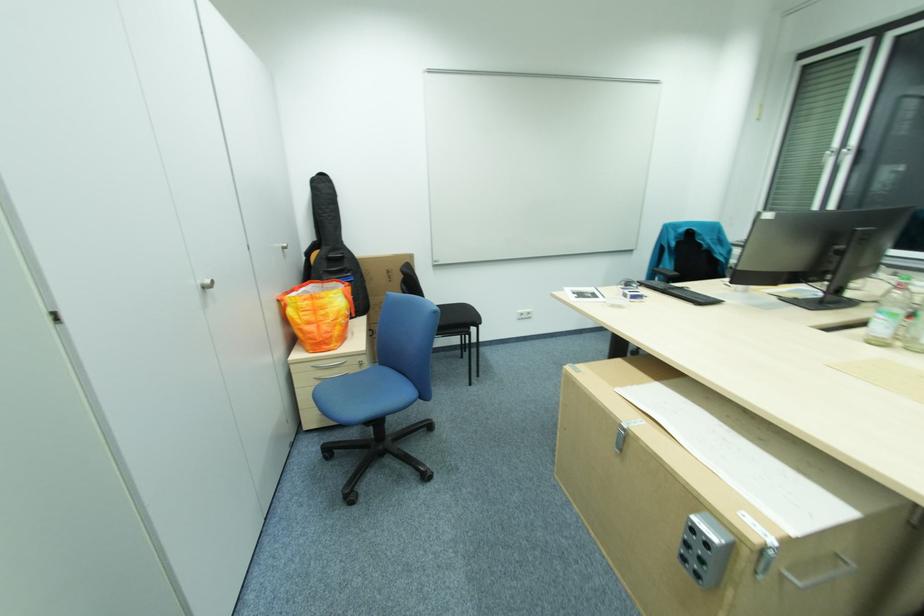
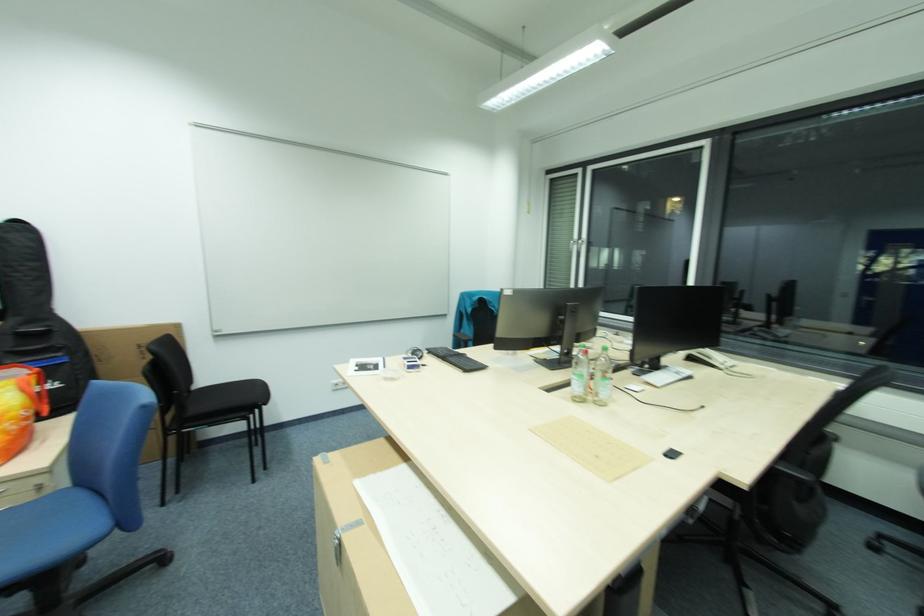
Find the pixel in the second image that matches point 366,369 in the first image.

(37, 498)